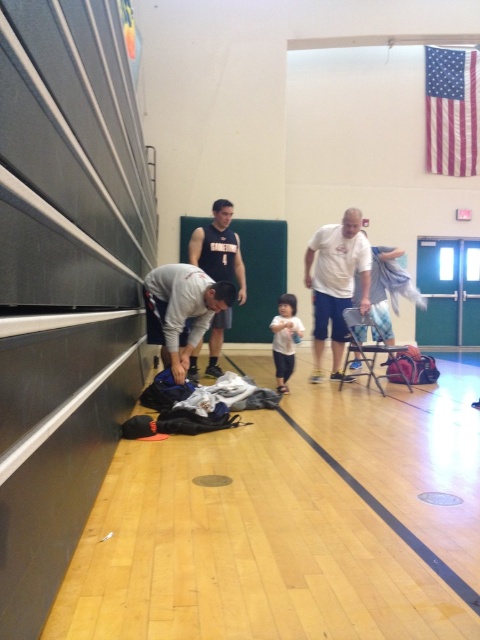
Question: Can you confirm if black jersey at center is wider than white cotton shirt at center?

Choices:
 (A) yes
 (B) no

Answer: (A)

Question: Can you confirm if metallic silver folding chair at center is wider than white cotton shirt at center?

Choices:
 (A) yes
 (B) no

Answer: (A)

Question: Considering the real-world distances, which object is farthest from the black jersey at center?

Choices:
 (A) white matte shirt at center
 (B) metallic silver folding chair at center
 (C) white cotton shirt at center

Answer: (B)

Question: Can you confirm if black jersey at center is positioned below metallic silver folding chair at center?

Choices:
 (A) no
 (B) yes

Answer: (A)

Question: Based on their relative distances, which object is nearer to the metallic silver folding chair at center?

Choices:
 (A) black jersey at center
 (B) white matte shirt at center
 (C) white cotton shirt at center

Answer: (B)

Question: Which point appears farthest from the camera in this image?

Choices:
 (A) (286, 369)
 (B) (344, 381)
 (C) (192, 349)
 (D) (308, 266)

Answer: (B)